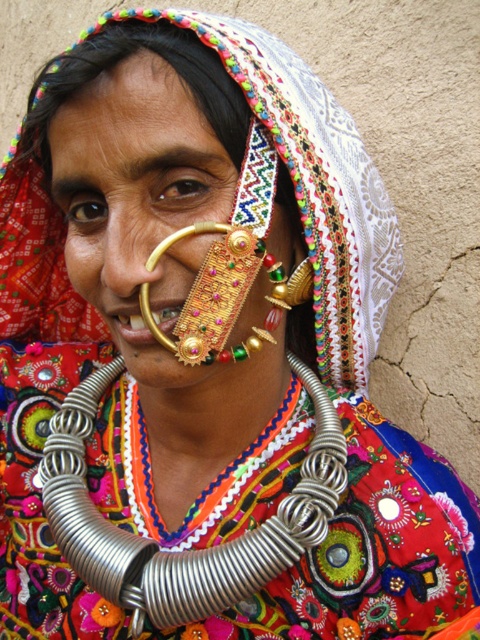
Question: Does silver/metallic necklace at center appear on the left side of gold/golden metal/earring at center?

Choices:
 (A) yes
 (B) no

Answer: (A)

Question: Does gold/embellished/earring at center appear on the left side of gold/golden metal/earring at center?

Choices:
 (A) yes
 (B) no

Answer: (A)

Question: Which point appears closest to the camera in this image?

Choices:
 (A) (84, 186)
 (B) (110, 536)
 (C) (219, 301)

Answer: (C)

Question: Among these objects, which one is nearest to the camera?

Choices:
 (A) gold/embellished/earring at center
 (B) silver/metallic necklace at center

Answer: (A)

Question: Does silver/metallic necklace at center have a larger size compared to gold/golden metal/earring at center?

Choices:
 (A) yes
 (B) no

Answer: (A)

Question: Which point appears farthest from the camera in this image?

Choices:
 (A) (276, 570)
 (B) (98, 289)
 (C) (194, 230)

Answer: (A)